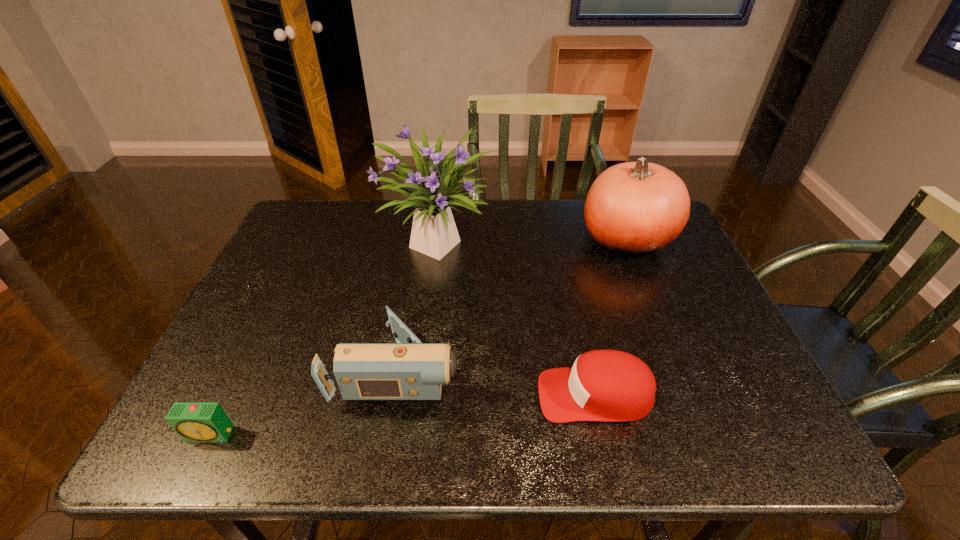
The image size is (960, 540). What are the coordinates of `the tallest object` in the screenshot? It's located at (434, 233).

Find the location of a particular element. Image resolution: width=960 pixels, height=540 pixels. pumpkin is located at coordinates (633, 208).

The width and height of the screenshot is (960, 540). In order to click on camcorder in this screenshot , I will do `click(409, 370)`.

The height and width of the screenshot is (540, 960). Identify the location of baseball cap. pos(602,385).

At what (x,y) coordinates should I click in order to perform the action: click on alarm clock. Please return your answer as a coordinate pair (x, y). The height and width of the screenshot is (540, 960). Looking at the image, I should click on (193, 421).

Where is `the shortest object`? the shortest object is located at coordinates point(193,421).

Locate an element on the screen. The image size is (960, 540). vacant space located 0.110m on the left of the tallest object is located at coordinates (343, 241).

The width and height of the screenshot is (960, 540). In order to click on vacant space located on the front of the pumpkin in this screenshot , I will do `click(669, 340)`.

Where is `vacant point located 0.090m on the side of the third shortest object with the flip-out screen`? This screenshot has width=960, height=540. vacant point located 0.090m on the side of the third shortest object with the flip-out screen is located at coordinates (501, 369).

Locate an element on the screen. free location located 0.350m on the front-facing side of the baseball cap is located at coordinates tap(368, 395).